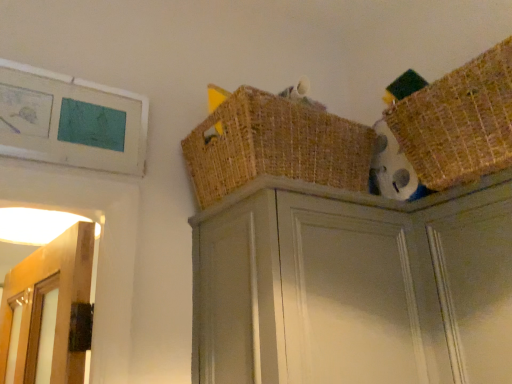
Question: Can you see woven brown basket at upper right, which appears as the 2th basket when viewed from the left, touching matte gray cabinet at upper center?

Choices:
 (A) yes
 (B) no

Answer: (B)

Question: Is woven brown basket at upper right, which is counted as the 1th basket, starting from the right, positioned far away from matte gray cabinet at upper center?

Choices:
 (A) yes
 (B) no

Answer: (B)

Question: Is matte gray cabinet at upper center completely or partially inside woven brown basket at upper right, which is counted as the 1th basket, starting from the right?

Choices:
 (A) no
 (B) yes

Answer: (A)

Question: Considering the relative sizes of woven brown basket at upper right, which appears as the 2th basket when viewed from the left, and matte gray cabinet at upper center in the image provided, is woven brown basket at upper right, which appears as the 2th basket when viewed from the left, taller than matte gray cabinet at upper center?

Choices:
 (A) no
 (B) yes

Answer: (A)

Question: From the image's perspective, is woven brown basket at upper right, which appears as the 2th basket when viewed from the left, below matte gray cabinet at upper center?

Choices:
 (A) no
 (B) yes

Answer: (A)

Question: Is woven brown basket at upper right, which is counted as the 1th basket, starting from the right, facing towards matte gray cabinet at upper center?

Choices:
 (A) yes
 (B) no

Answer: (B)

Question: Considering the relative sizes of woven brown basket at upper center, the second basket viewed from the right, and woven brown basket at upper right, which appears as the 2th basket when viewed from the left, in the image provided, is woven brown basket at upper center, the second basket viewed from the right, shorter than woven brown basket at upper right, which appears as the 2th basket when viewed from the left,?

Choices:
 (A) yes
 (B) no

Answer: (A)

Question: Is woven brown basket at upper center, arranged as the 1th basket when viewed from the left, behind woven brown basket at upper right, which is counted as the 1th basket, starting from the right?

Choices:
 (A) no
 (B) yes

Answer: (B)

Question: Is woven brown basket at upper center, the second basket viewed from the right, wider than woven brown basket at upper right, which appears as the 2th basket when viewed from the left?

Choices:
 (A) no
 (B) yes

Answer: (B)

Question: Can you confirm if woven brown basket at upper center, the second basket viewed from the right, is taller than woven brown basket at upper right, which is counted as the 1th basket, starting from the right?

Choices:
 (A) no
 (B) yes

Answer: (A)

Question: From the image's perspective, is woven brown basket at upper center, the second basket viewed from the right, on woven brown basket at upper right, which appears as the 2th basket when viewed from the left?

Choices:
 (A) no
 (B) yes

Answer: (A)

Question: Is woven brown basket at upper center, arranged as the 1th basket when viewed from the left, positioned with its back to woven brown basket at upper right, which appears as the 2th basket when viewed from the left?

Choices:
 (A) no
 (B) yes

Answer: (A)

Question: Is matte gray cabinet at upper center with woven brown basket at upper right, which appears as the 2th basket when viewed from the left?

Choices:
 (A) no
 (B) yes

Answer: (A)